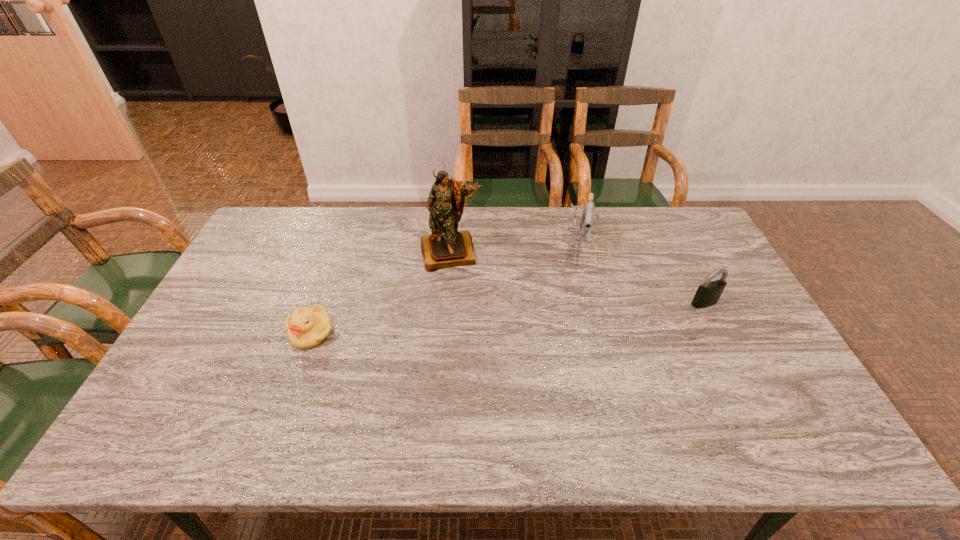
I want to click on vacant area that lies between the rightmost object and the figurine, so click(578, 278).

This screenshot has width=960, height=540. What are the coordinates of `empty space that is in between the second shortest object and the third object from right to left` in the screenshot? It's located at pyautogui.click(x=578, y=278).

I want to click on free spot between the figurine and the second shortest object, so click(x=578, y=278).

Locate an element on the screen. This screenshot has height=540, width=960. vacant area between the duckling and the second nearest object is located at coordinates (508, 318).

Identify the location of free spot between the third object from right to left and the third farthest object. This screenshot has width=960, height=540. (578, 278).

The height and width of the screenshot is (540, 960). I want to click on object identified as the closest to the leftmost object, so click(x=446, y=247).

At what (x,y) coordinates should I click in order to perform the action: click on object that ranks as the closest to the tallest object. Please return your answer as a coordinate pair (x, y). Image resolution: width=960 pixels, height=540 pixels. Looking at the image, I should click on (587, 218).

This screenshot has height=540, width=960. I want to click on free spot that satisfies the following two spatial constraints: 1. on the front side of the tallest object; 2. on the left side of the padlock, so click(x=447, y=302).